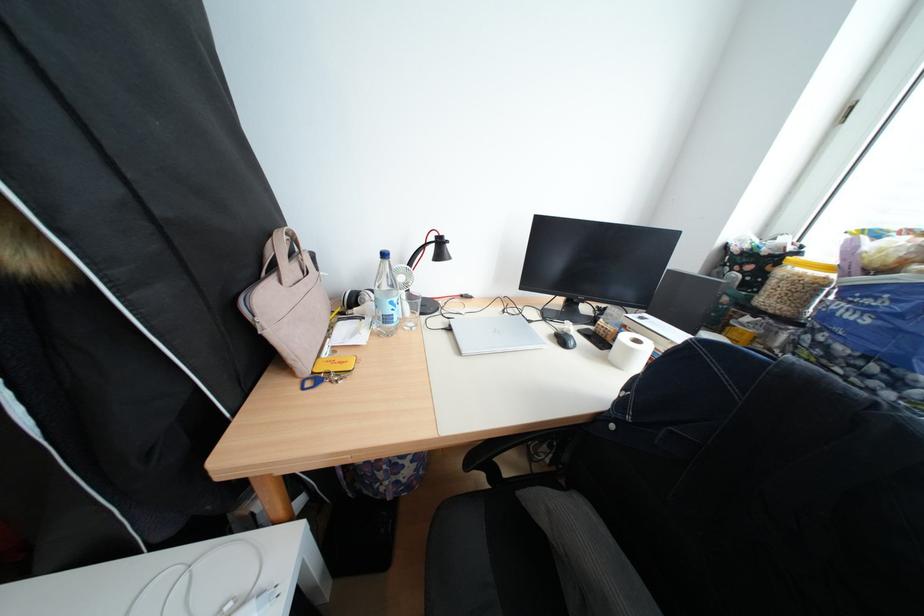
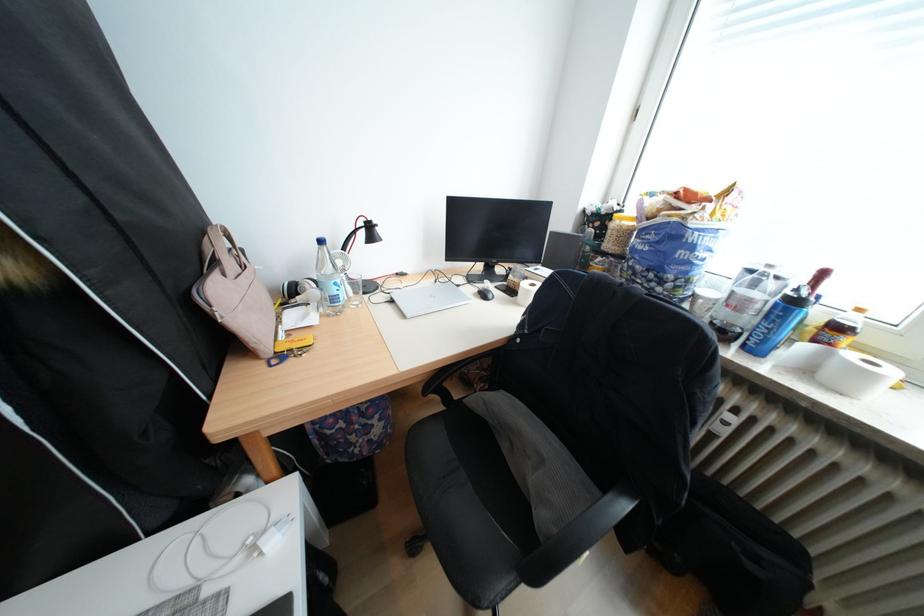
The point at (381,321) is marked in the first image. Where is the corresponding point in the second image?

(325, 306)